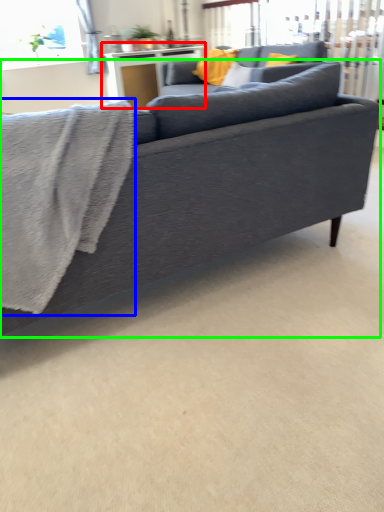
Question: Which is nearer to the table (highlighted by a red box)? bath towel (highlighted by a blue box) or studio couch (highlighted by a green box).

Choices:
 (A) bath towel
 (B) studio couch

Answer: (B)